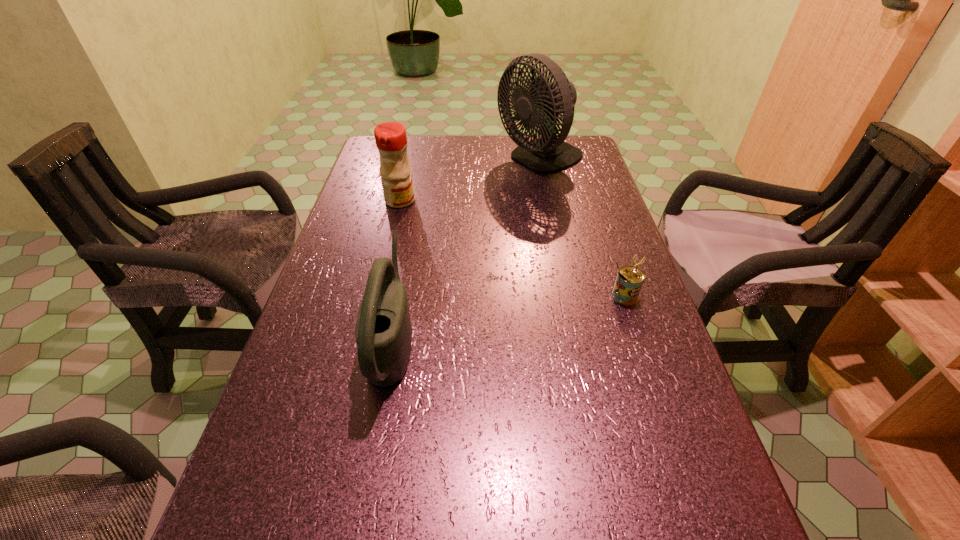
The width and height of the screenshot is (960, 540). What are the coordinates of `vacant area that lies between the condiment and the shortest object` in the screenshot? It's located at (513, 248).

Locate an element on the screen. Image resolution: width=960 pixels, height=540 pixels. free area in between the shortest object and the third nearest object is located at coordinates (513, 248).

The width and height of the screenshot is (960, 540). In order to click on free area in between the shortest object and the watering can in this screenshot , I will do `click(510, 317)`.

Where is `blank region between the shortest object and the fan`? blank region between the shortest object and the fan is located at coordinates (583, 228).

Where is `the third closest object relative to the can`? The height and width of the screenshot is (540, 960). the third closest object relative to the can is located at coordinates (391, 140).

Point out which object is positioned as the third nearest to the can. Please provide its 2D coordinates. Your answer should be formatted as a tuple, i.e. [(x, y)], where the tuple contains the x and y coordinates of a point satisfying the conditions above.

[(391, 140)]

Identify the location of blank space that satisfies the following two spatial constraints: 1. in front of the farthest object to direct airflow; 2. on the right side of the can. (568, 296).

Identify the location of free location that satisfies the following two spatial constraints: 1. in front of the shortest object to direct airflow; 2. on the right side of the tallest object. (568, 296).

You are a GUI agent. You are given a task and a screenshot of the screen. Output one action in this format:
    pyautogui.click(x=<x>, y=<y>)
    Task: Click on the free space that satisfies the following two spatial constraints: 1. in front of the tallest object to direct airflow; 2. on the back side of the shortest object
    
    Given the screenshot: What is the action you would take?
    pyautogui.click(x=568, y=296)